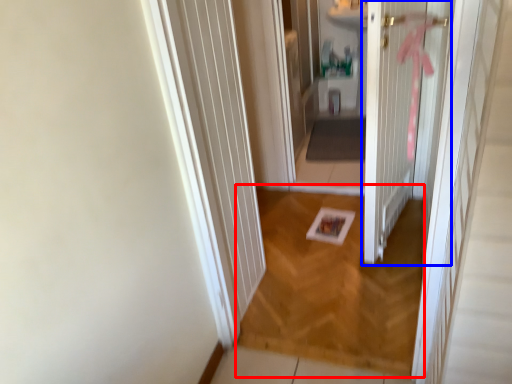
Question: Which of the following is the farthest to the observer, plain (highlighted by a red box) or door (highlighted by a blue box)?

Choices:
 (A) plain
 (B) door

Answer: (A)